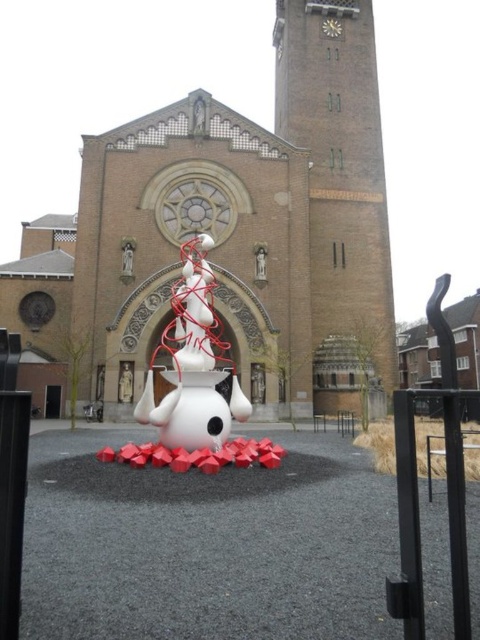
You are standing at the point marked by coordinates point (228, 234) in the image. What is the nearest object to you?

The nearest object to you is the brown brick church at center, as the point (228, 234) marks its location.

You are standing at the point marked by coordinates point (228, 234) in the image. Describe the structure directly beneath your feet.

The structure directly beneath the point (228, 234) is the brown brick church at center, which is the main architectural feature in the scene.